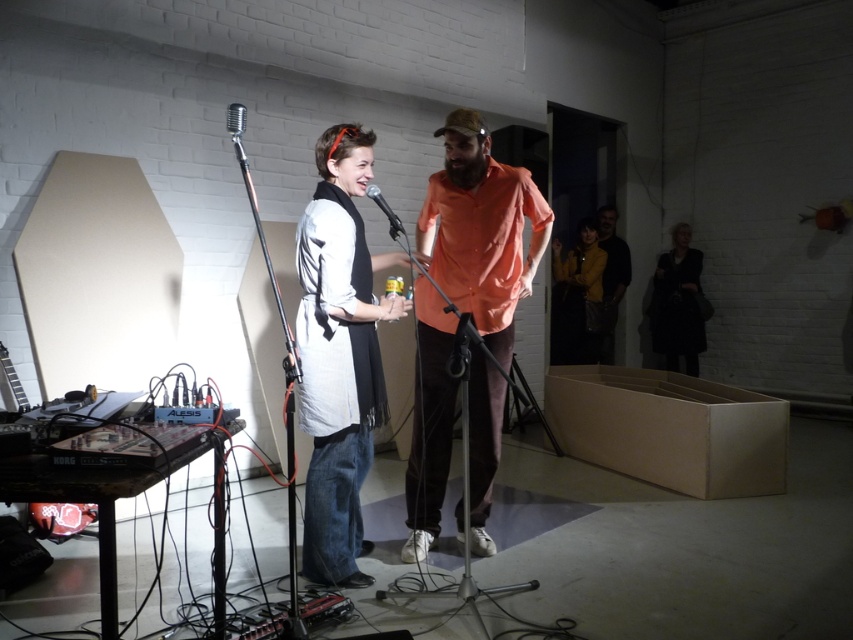
You are standing in the performance space and need to locate the white cotton shirt at center. According to the coordinates provided, where exactly would you find it?

The white cotton shirt at center is located at point 0.555 in the x coordinate and 0.399 in the y coordinate.

You are a photographer setting up a shoot in this space. You need to position a backdrop that can cover both the white cotton shirt at center and the yellow leather jacket at center. Based on their sizes, which object requires a larger coverage area?

The white cotton shirt at center might be wider than yellow leather jacket at center, so the backdrop should be sized to accommodate the white cotton shirt at center first.